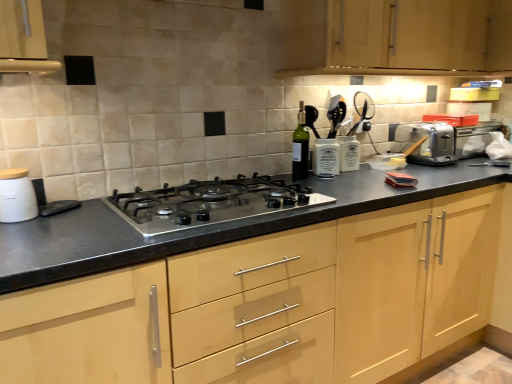
What are the coordinates of `spots to the right of white matte canister at left` in the screenshot? It's located at click(71, 220).